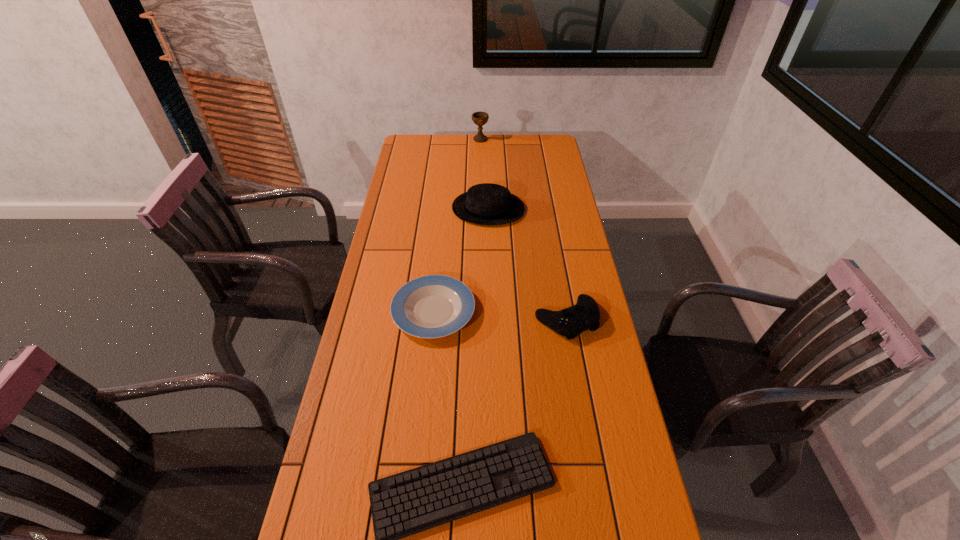
Locate an element on the screen. free spot between the plate and the chalice is located at coordinates pyautogui.click(x=457, y=225).

In order to click on free space between the farthest object and the control in this screenshot , I will do `click(523, 230)`.

Locate an element on the screen. vacant point located between the fourth tallest object and the fedora is located at coordinates (461, 260).

Identify the location of free space between the fourth nearest object and the second shortest object. (461, 260).

Identify which object is the second nearest to the plate. Please provide its 2D coordinates. Your answer should be formatted as a tuple, i.e. [(x, y)], where the tuple contains the x and y coordinates of a point satisfying the conditions above.

[(403, 504)]

Select which object appears as the fourth closest to the control. Please provide its 2D coordinates. Your answer should be formatted as a tuple, i.e. [(x, y)], where the tuple contains the x and y coordinates of a point satisfying the conditions above.

[(480, 118)]

Locate an element on the screen. free location that satisfies the following two spatial constraints: 1. on the back side of the fourth shortest object; 2. on the right side of the fourth tallest object is located at coordinates (444, 209).

You are a GUI agent. You are given a task and a screenshot of the screen. Output one action in this format:
    pyautogui.click(x=<x>, y=<y>)
    Task: Click on the free space that satisfies the following two spatial constraints: 1. on the back side of the fedora; 2. on the right side of the plate
    The height and width of the screenshot is (540, 960).
    Given the screenshot: What is the action you would take?
    pyautogui.click(x=444, y=209)

Where is `vacant space that satisfies the following two spatial constraints: 1. on the back side of the fourth nearest object; 2. on the left side of the plate`? The width and height of the screenshot is (960, 540). vacant space that satisfies the following two spatial constraints: 1. on the back side of the fourth nearest object; 2. on the left side of the plate is located at coordinates (444, 209).